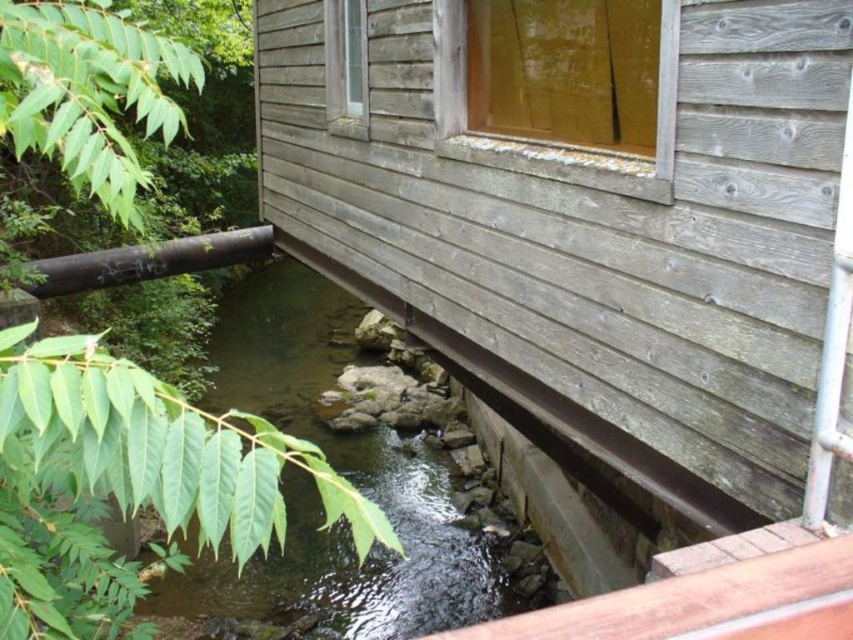
Question: Is clear water at center to the left of black metal pipe at lower left from the viewer's perspective?

Choices:
 (A) yes
 (B) no

Answer: (B)

Question: In this image, where is clear water at center located relative to black metal pipe at lower left?

Choices:
 (A) left
 (B) right

Answer: (B)

Question: Is clear water at center wider than black metal pipe at lower left?

Choices:
 (A) yes
 (B) no

Answer: (A)

Question: Which of the following is the farthest from the observer?

Choices:
 (A) clear water at center
 (B) black metal pipe at lower left

Answer: (B)